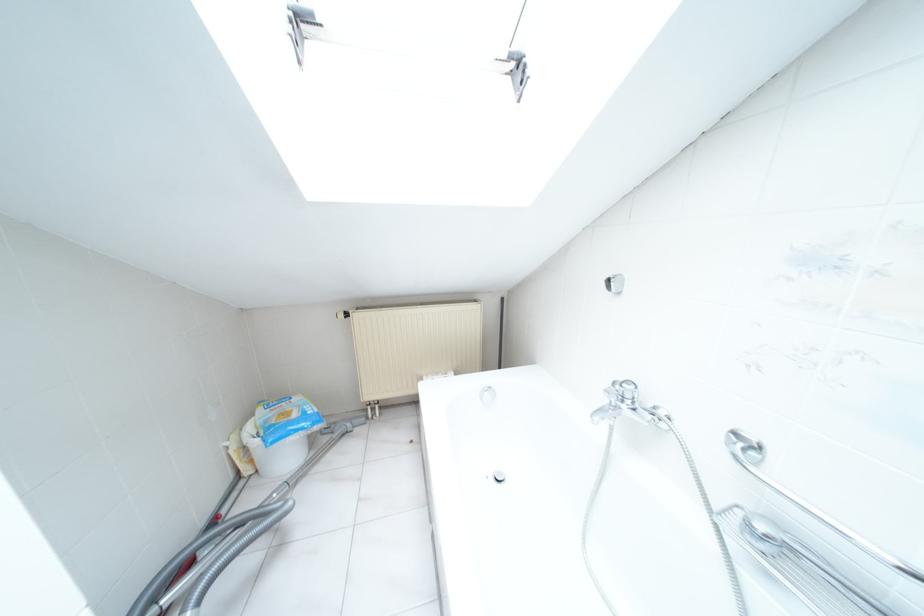
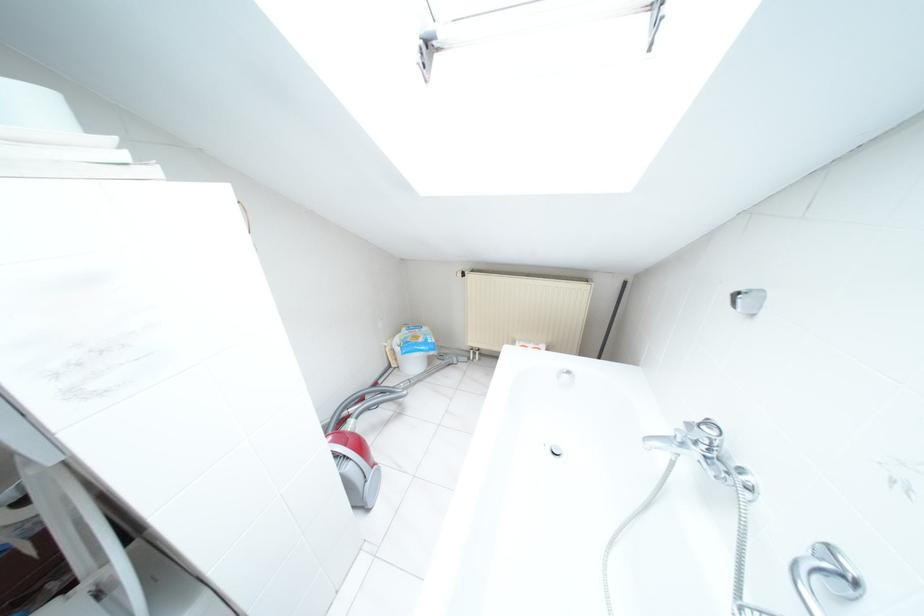
Locate, in the second image, the point that corresponds to point 618,293 in the first image.

(752, 315)